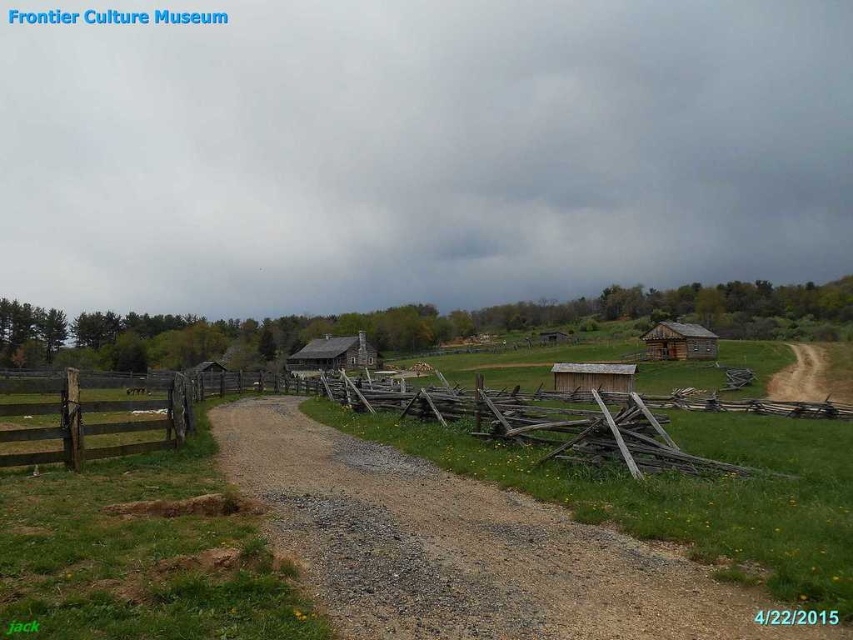
Question: In this image, where is brown gravel road at center located relative to wooden hut at center?

Choices:
 (A) below
 (B) above

Answer: (A)

Question: Which of the following is the farthest from the observer?

Choices:
 (A) (293, 365)
 (B) (383, 577)
 (C) (665, 344)

Answer: (A)

Question: Which of the following is the closest to the observer?

Choices:
 (A) (299, 349)
 (B) (572, 365)
 (C) (709, 356)
 (D) (334, 532)

Answer: (D)

Question: Can you confirm if brown gravel road at center is thinner than wooden cabin at center?

Choices:
 (A) yes
 (B) no

Answer: (A)

Question: Among these points, which one is nearest to the camera?

Choices:
 (A) (555, 380)
 (B) (305, 353)
 (C) (462, 573)
 (D) (686, 339)

Answer: (C)

Question: Is wooden cabin at center further to camera compared to wooden hut at center?

Choices:
 (A) no
 (B) yes

Answer: (B)